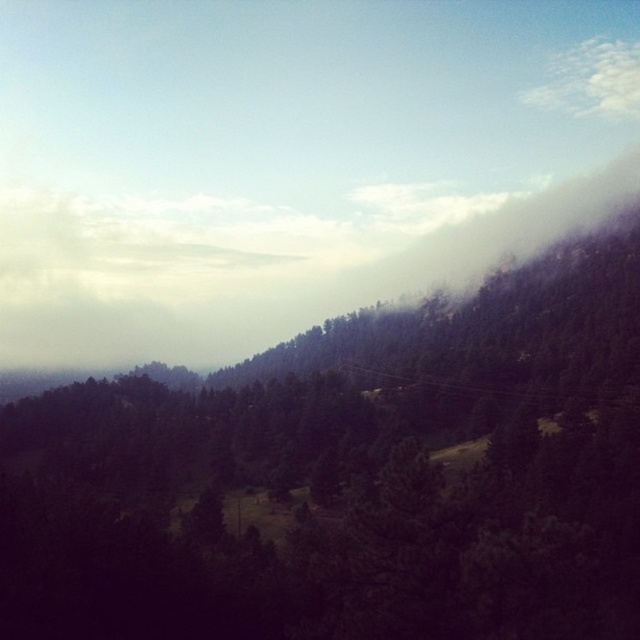
You are an observer standing in the forest looking towards the mountains. You see the green matte tree at center and the white fluffy cloud at upper right. Which object is nearer to you?

The green matte tree at center is closer to the viewer than the white fluffy cloud at upper right.

You are an observer standing in the forest. You see the green matte tree at center and the white fluffy cloud at upper right. Which object is positioned to the left of the other?

The green matte tree at center is positioned to the left of the white fluffy cloud at upper right.

You are standing at the origin point in the image and want to locate the green matte tree at center. In which direction should you move to reach it?

The green matte tree at center is located at coordinates point (x=349, y=476), so you should move towards the right and slightly forward to reach it.